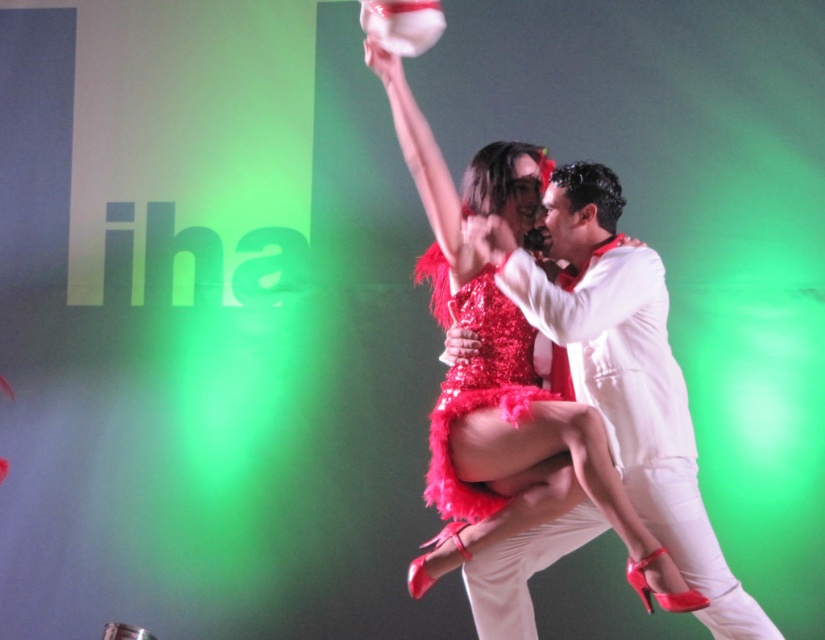
Question: Among these points, which one is nearest to the camera?

Choices:
 (A) (573, 170)
 (B) (455, 396)

Answer: (A)

Question: Is white satin suit at center to the left of shiny sequined dress at center from the viewer's perspective?

Choices:
 (A) no
 (B) yes

Answer: (A)

Question: Which point appears farthest from the camera in this image?

Choices:
 (A) (453, 516)
 (B) (517, 556)

Answer: (A)

Question: Does white satin suit at center appear on the left side of shiny sequined dress at center?

Choices:
 (A) no
 (B) yes

Answer: (A)

Question: Which point appears closest to the camera in this image?

Choices:
 (A) (521, 387)
 (B) (640, 481)

Answer: (B)

Question: Is white satin suit at center further to the viewer compared to shiny sequined dress at center?

Choices:
 (A) yes
 (B) no

Answer: (B)